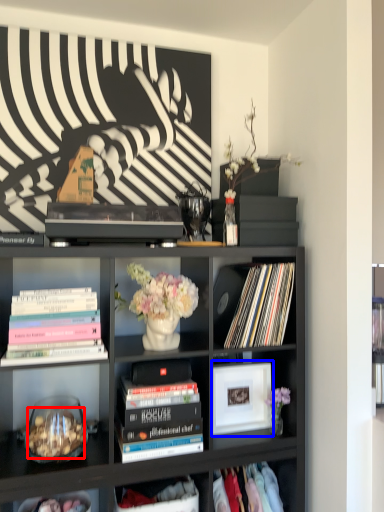
Question: Which object is further to the camera taking this photo, food (highlighted by a red box) or picture frame (highlighted by a blue box)?

Choices:
 (A) food
 (B) picture frame

Answer: (B)